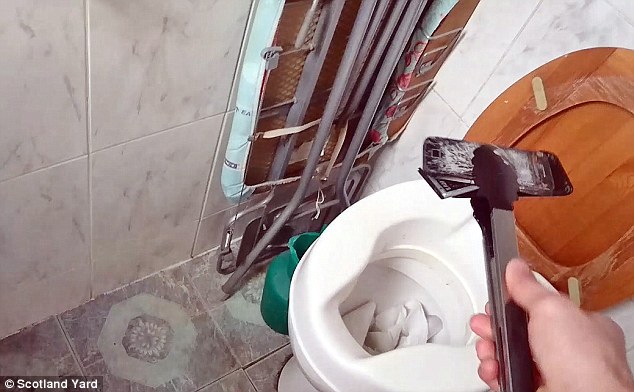
Where is `toilet lid`? The width and height of the screenshot is (634, 392). toilet lid is located at coordinates tap(589, 160).